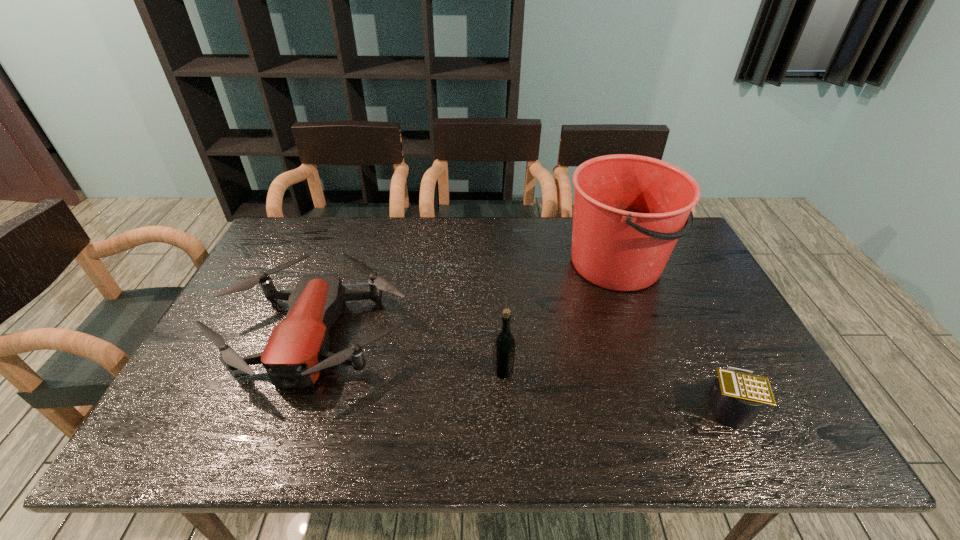
Identify the location of vacant space at the far left corner of the desktop. The width and height of the screenshot is (960, 540). (295, 255).

Where is `vacant space at the near left corner`? The width and height of the screenshot is (960, 540). vacant space at the near left corner is located at coordinates (174, 435).

The image size is (960, 540). Find the location of `vacant area between the calculator and the bucket`. vacant area between the calculator and the bucket is located at coordinates (672, 335).

The image size is (960, 540). Find the location of `free space between the calculator and the bucket`. free space between the calculator and the bucket is located at coordinates (672, 335).

Where is `free space between the calculator and the drone`? This screenshot has width=960, height=540. free space between the calculator and the drone is located at coordinates [x=521, y=369].

Where is `free spot between the calculator and the tallest object`? free spot between the calculator and the tallest object is located at coordinates (672, 335).

Where is `free area in between the tallest object and the beer bottle`? This screenshot has height=540, width=960. free area in between the tallest object and the beer bottle is located at coordinates (560, 318).

At what (x,y) coordinates should I click in order to perform the action: click on free spot between the tallest object and the second object from left to right. Please return your answer as a coordinate pair (x, y). This screenshot has height=540, width=960. Looking at the image, I should click on (560, 318).

Where is `blank region between the bucket and the third object from right to left`? blank region between the bucket and the third object from right to left is located at coordinates (560, 318).

At what (x,y) coordinates should I click in order to perform the action: click on blank region between the calculator and the tallest object. Please return your answer as a coordinate pair (x, y). Looking at the image, I should click on (672, 335).